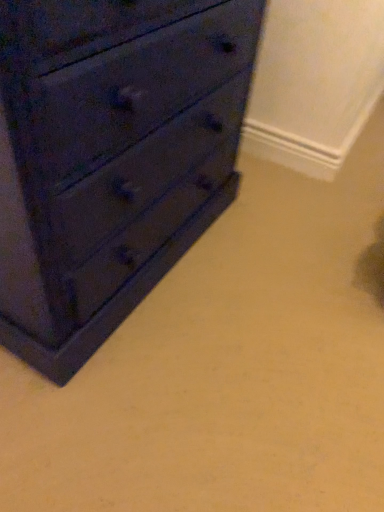
Measure the distance between matte dark blue dresser at left and camera.

matte dark blue dresser at left and camera are 19.52 inches apart.

The height and width of the screenshot is (512, 384). What do you see at coordinates (110, 157) in the screenshot?
I see `matte dark blue dresser at left` at bounding box center [110, 157].

The height and width of the screenshot is (512, 384). I want to click on matte dark blue dresser at left, so click(x=110, y=157).

Where is `matte dark blue dresser at left`? Image resolution: width=384 pixels, height=512 pixels. matte dark blue dresser at left is located at coordinates (110, 157).